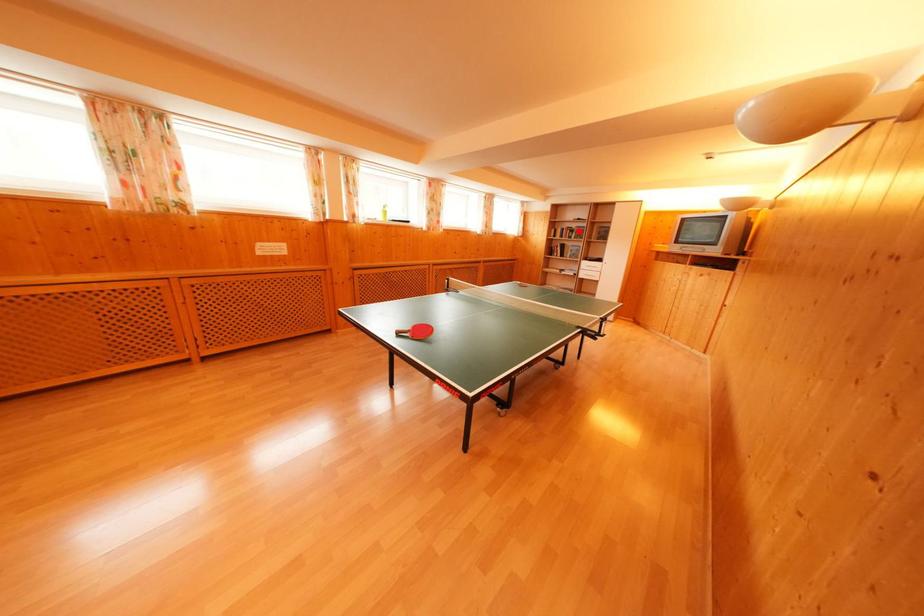
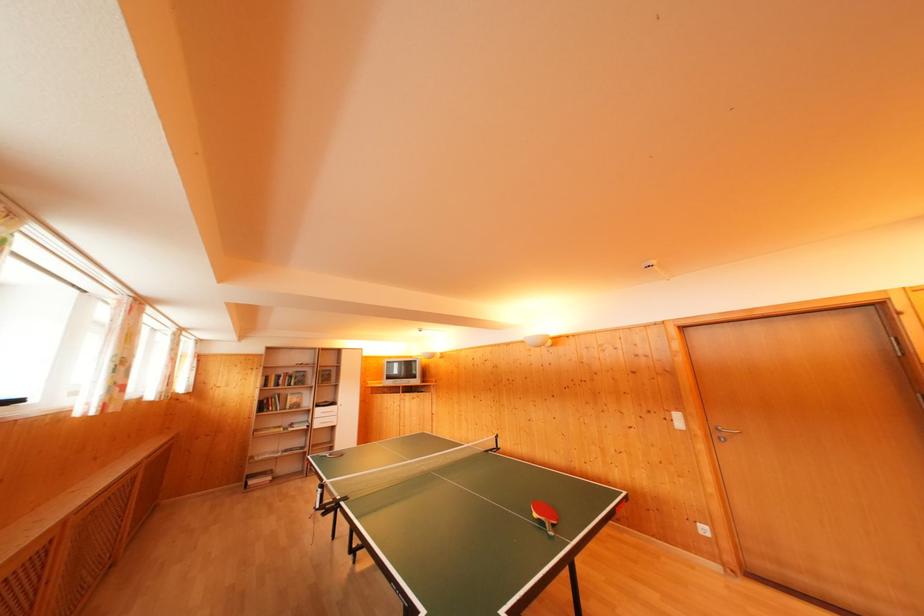
Find the pixel in the second image that matches the highlighted location in the first image.

(296, 376)